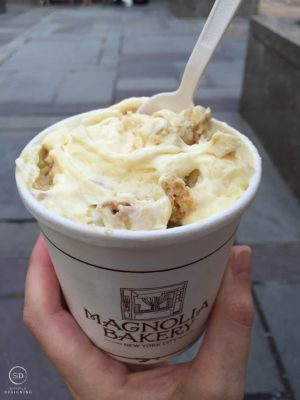
Locate an element on the screen. Image resolution: width=300 pixels, height=400 pixels. wall is located at coordinates (263, 51).